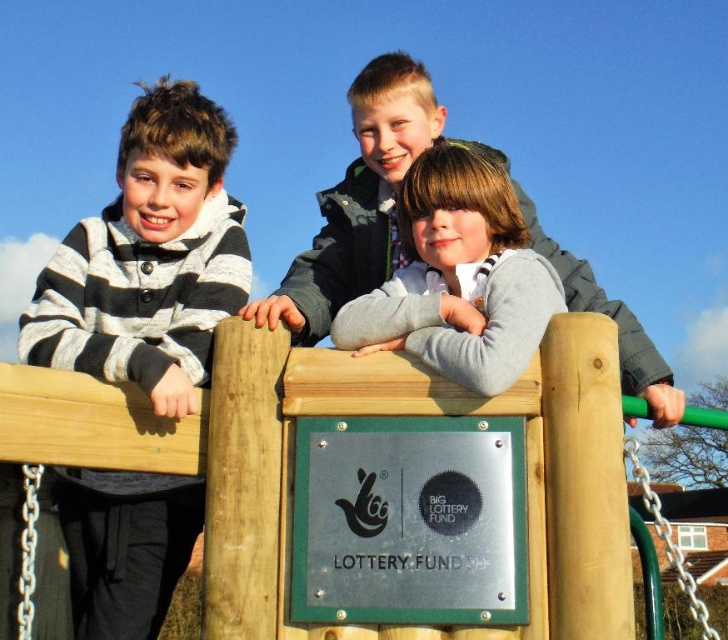
Question: Among these points, which one is nearest to the camera?

Choices:
 (A) (483, 381)
 (B) (178, 532)

Answer: (A)

Question: Based on their relative distances, which object is nearer to the gray fleece jacket at center?

Choices:
 (A) gray matte sweater at center
 (B) striped knit sweater at left

Answer: (A)

Question: Is gray matte sweater at center behind gray fleece jacket at center?

Choices:
 (A) yes
 (B) no

Answer: (B)

Question: Does striped knit sweater at left appear on the right side of gray fleece jacket at center?

Choices:
 (A) no
 (B) yes

Answer: (A)

Question: Is gray matte sweater at center below gray fleece jacket at center?

Choices:
 (A) no
 (B) yes

Answer: (B)

Question: Which point is closer to the camera taking this photo?

Choices:
 (A) (127, 269)
 (B) (357, 284)
 (C) (550, 300)

Answer: (C)